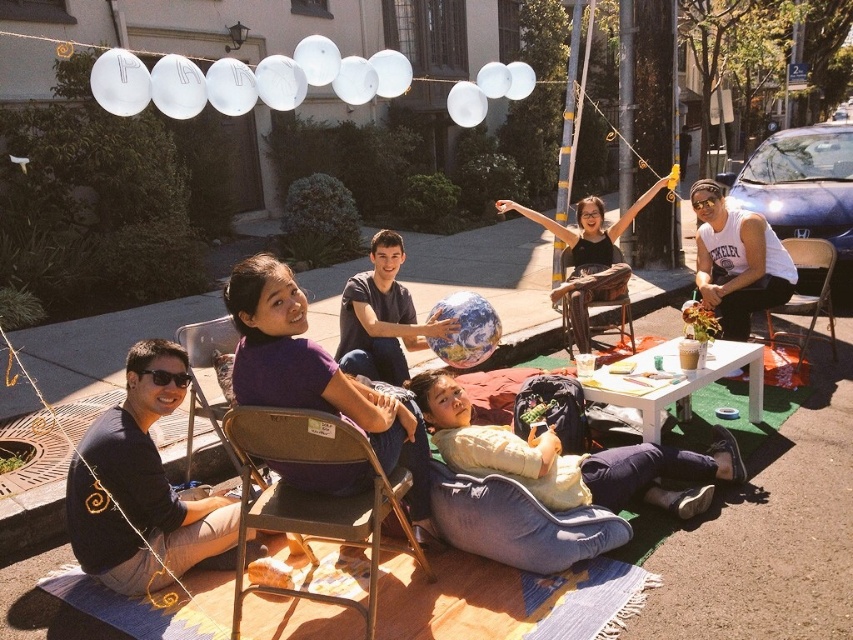
You are at the gathering and want to take a photo of the smooth blue globe at center without including the purple fabric shirt at center in the frame. Is this possible based on their positions?

The purple fabric shirt at center is to the left of the smooth blue globe at center, so if you position yourself to the left of the globe and angle the camera away from the shirt, you can capture the globe without the shirt in the frame.

In the scene shown: You are planning to set up a small table between the wooden swing at center and the brown fabric chair at center for serving snacks. The table requires 4 meters of space. Based on the scene, can you fit the table between them?

The wooden swing at center is 3.63 meters away from the brown fabric chair at center. Since the required space for the table is 4 meters, which is longer than the available distance, the table cannot be placed between them.